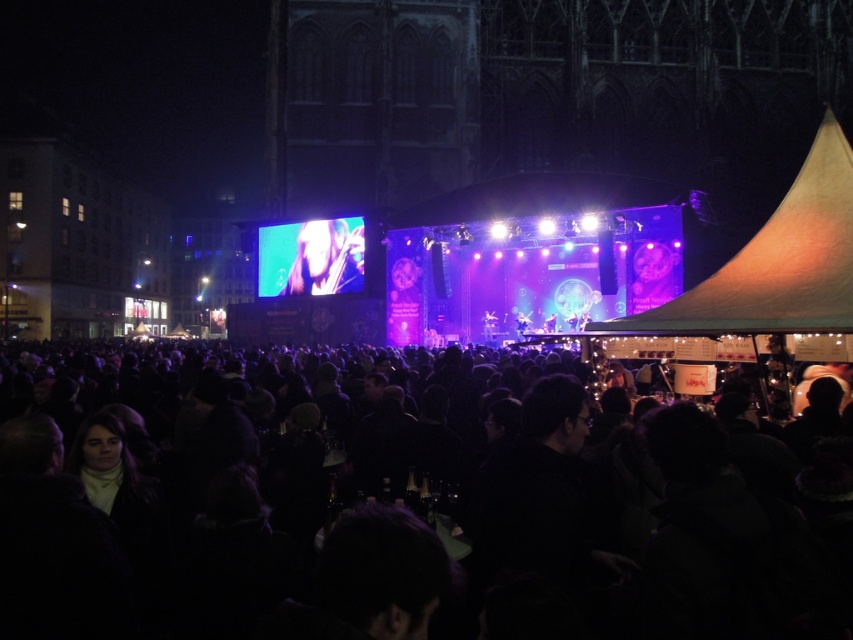
Can you confirm if black matte crowd at center is positioned to the left of smooth skin face at center?

In fact, black matte crowd at center is to the right of smooth skin face at center.

What do you see at coordinates (405, 544) in the screenshot?
I see `black matte crowd at center` at bounding box center [405, 544].

Where is `black matte crowd at center`? The height and width of the screenshot is (640, 853). black matte crowd at center is located at coordinates (405, 544).